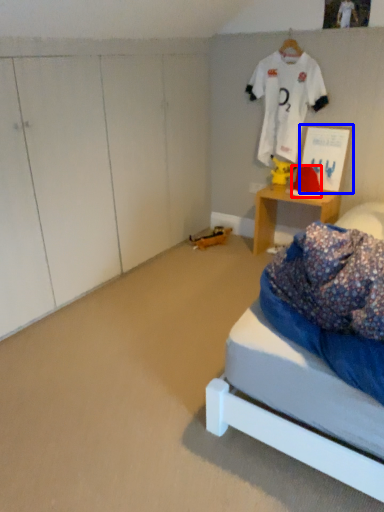
Question: Which point is further to the camera, hat (highlighted by a red box) or picture frame (highlighted by a blue box)?

Choices:
 (A) hat
 (B) picture frame

Answer: (A)